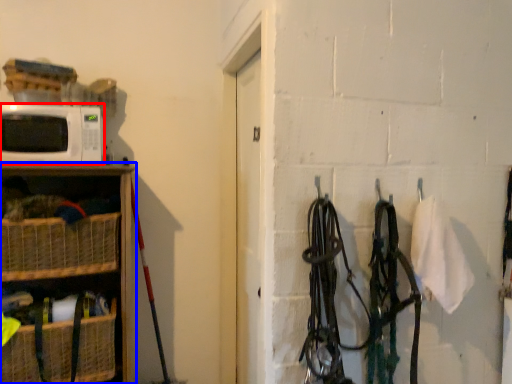
Question: Which point is further to the camera, microwave oven (highlighted by a red box) or shelf (highlighted by a blue box)?

Choices:
 (A) microwave oven
 (B) shelf

Answer: (A)